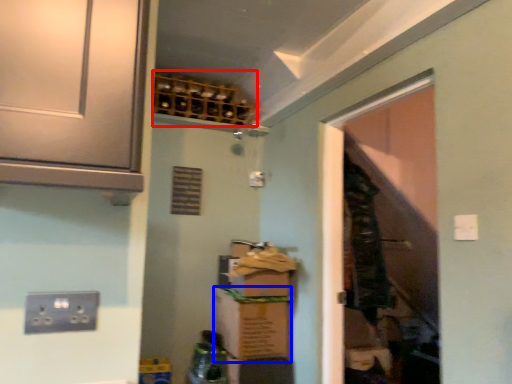
Question: Among these objects, which one is nearest to the camera, wine rack (highlighted by a red box) or cardboard box (highlighted by a blue box)?

Choices:
 (A) wine rack
 (B) cardboard box

Answer: (B)